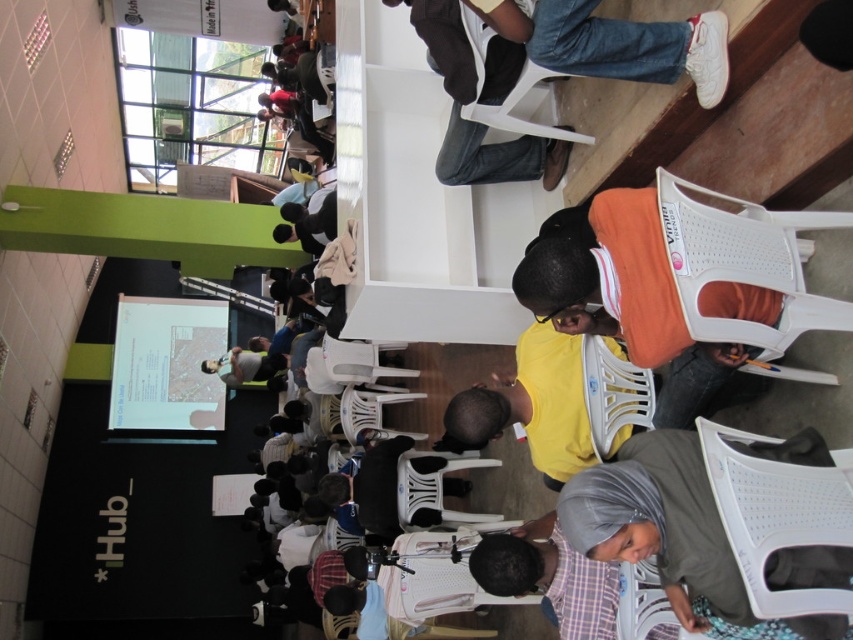
Question: Which point is farther to the camera?

Choices:
 (A) white plastic chair at center
 (B) white mesh chair at lower right
 (C) white plastic chair at lower right
 (D) white plastic chair at upper center

Answer: (D)

Question: Based on their relative distances, which object is farther from the white mesh chair at lower right?

Choices:
 (A) white plastic chair at lower right
 (B) white plastic chair at upper center
 (C) white plastic chair at center

Answer: (B)

Question: Can you confirm if white plastic chair at lower right is positioned above white plastic chair at center?

Choices:
 (A) yes
 (B) no

Answer: (A)

Question: Can you confirm if white mesh chair at lower right is thinner than white plastic chair at upper center?

Choices:
 (A) yes
 (B) no

Answer: (A)

Question: Considering the relative positions of white plastic chair at lower right and white mesh chair at lower right in the image provided, where is white plastic chair at lower right located with respect to white mesh chair at lower right?

Choices:
 (A) above
 (B) below

Answer: (A)

Question: Which point is farther to the camera?

Choices:
 (A) 700,429
 (B) 492,35
 (C) 607,413
 (D) 682,282

Answer: (B)